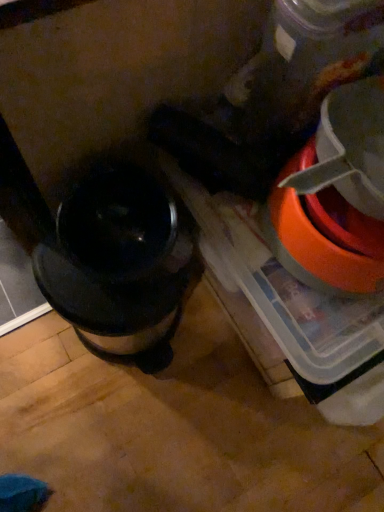
I want to click on free spot to the right of shiny metallic coffee maker at left, so click(216, 370).